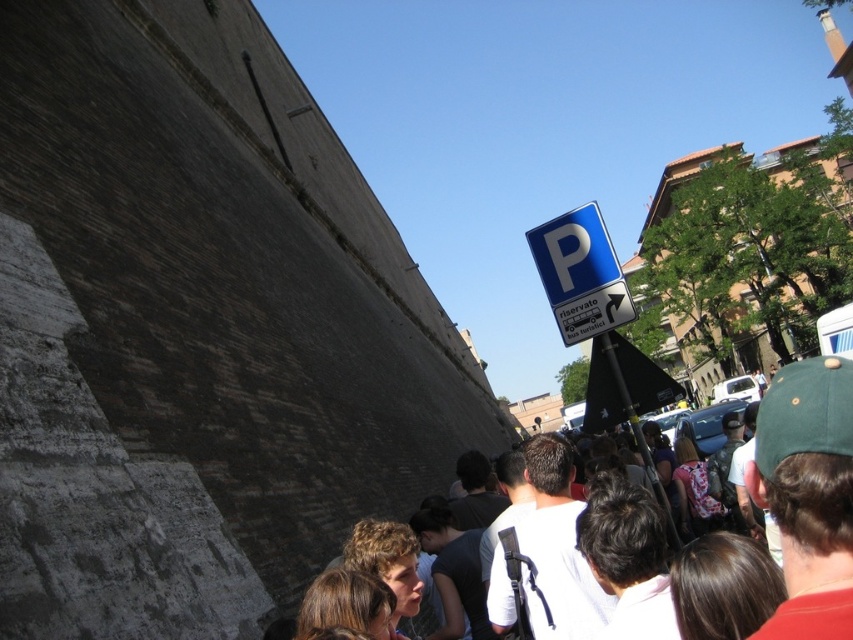
You are a photographer standing in the middle of the scene. You notice the brown hair at center and the blue plastic parking sign at upper right. Which object is taller?

The brown hair at center is taller than the blue plastic parking sign at upper right.

You are a tourist in an Italian city and see the blue plastic parking sign at upper right and the brown hair at center. According to the scene, which object is located higher up?

The blue plastic parking sign at upper right is higher up than the brown hair at center.

Consider the image. You are a photographer standing in the urban scene. You notice the brown hair at center and the blue plastic parking sign at upper right. Which object appears narrower in the image?

The brown hair at center appears narrower because it has a lesser width compared to the blue plastic parking sign at upper right.